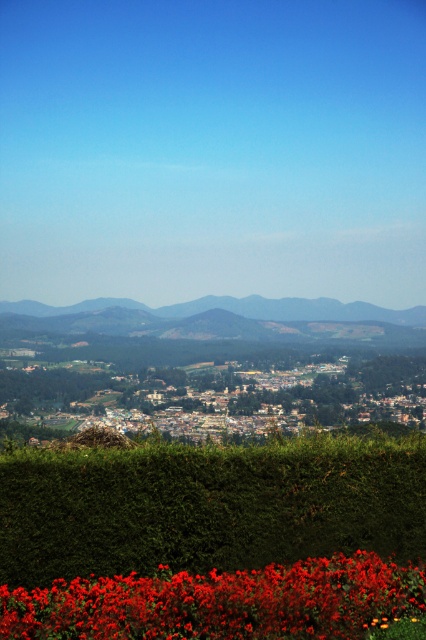
Which is more to the right, vibrant matte red flowers at bottom or gray textured mountain at center?

Positioned to the right is vibrant matte red flowers at bottom.

Which of these two, vibrant matte red flowers at bottom or gray textured mountain at center, stands shorter?

Standing shorter between the two is vibrant matte red flowers at bottom.

In the scene shown: Who is more forward, (192, 614) or (184, 308)?

Positioned in front is point (192, 614).

Locate an element on the screen. vibrant matte red flowers at bottom is located at coordinates (227, 604).

Which is below, green leafy hedge at lower center or vibrant matte red flowers at bottom?

vibrant matte red flowers at bottom

Which is in front, point (19, 538) or point (195, 618)?

Point (195, 618)

Find the location of `green leafy hedge at lower center`. green leafy hedge at lower center is located at coordinates (207, 506).

You are a GUI agent. You are given a task and a screenshot of the screen. Output one action in this format:
    pyautogui.click(x=<x>, y=<y>)
    Task: Click on the green leafy hedge at lower center
    
    Given the screenshot: What is the action you would take?
    pyautogui.click(x=207, y=506)

Can you confirm if green leafy hedge at lower center is thinner than gray textured mountain at center?

Yes, green leafy hedge at lower center is thinner than gray textured mountain at center.

Can you confirm if green leafy hedge at lower center is shorter than gray textured mountain at center?

Yes.

Identify the location of green leafy hedge at lower center. The height and width of the screenshot is (640, 426). (207, 506).